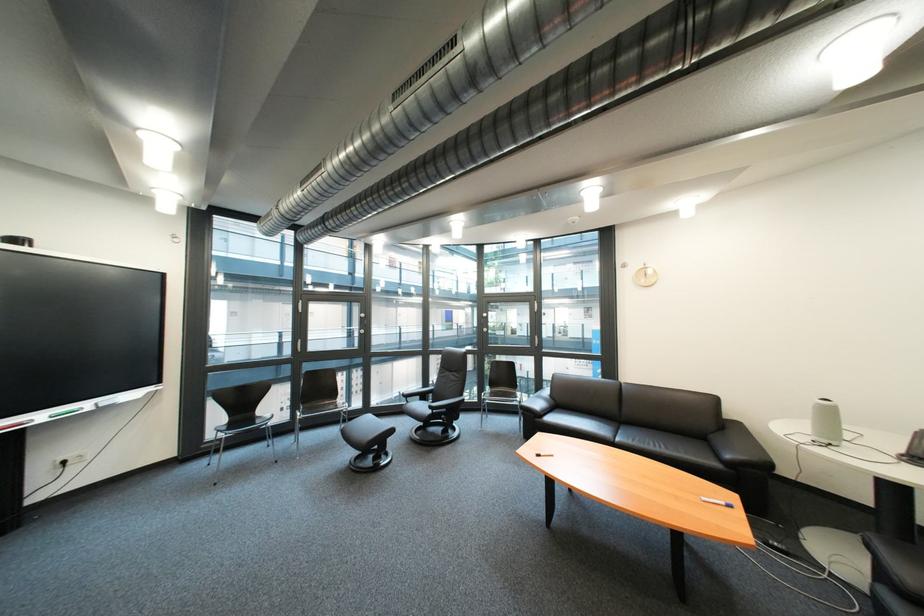
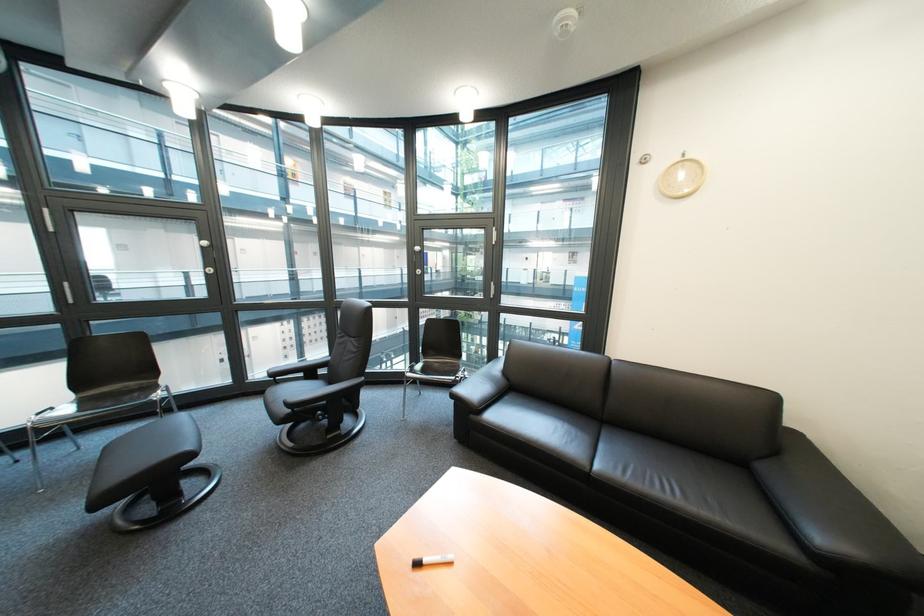
In the scene shown: What movement of the cameraman would produce the second image?

The cameraman walked toward right, forward.